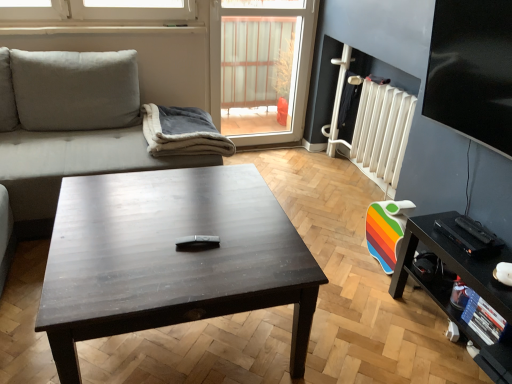
Question: Is the position of gray fleece blanket at center less distant than that of black glossy tv stand at lower right?

Choices:
 (A) no
 (B) yes

Answer: (A)

Question: Is gray fleece blanket at center far away from black glossy tv stand at lower right?

Choices:
 (A) yes
 (B) no

Answer: (A)

Question: Is gray fleece blanket at center aimed at black glossy tv stand at lower right?

Choices:
 (A) yes
 (B) no

Answer: (B)

Question: Can you confirm if gray fleece blanket at center is thinner than black glossy tv stand at lower right?

Choices:
 (A) yes
 (B) no

Answer: (B)

Question: From the image's perspective, is gray fleece blanket at center over black glossy tv stand at lower right?

Choices:
 (A) no
 (B) yes

Answer: (B)

Question: Is transparent glass window screen at upper right, the 2th window screen viewed from the left, in front of or behind white plastic radiator at right in the image?

Choices:
 (A) front
 (B) behind

Answer: (A)

Question: Is transparent glass window screen at upper right, the 2th window screen viewed from the left, to the left or to the right of white plastic radiator at right in the image?

Choices:
 (A) right
 (B) left

Answer: (A)

Question: Which is correct: transparent glass window screen at upper right, which ranks as the second window screen in back-to-front order, is inside white plastic radiator at right, or outside of it?

Choices:
 (A) outside
 (B) inside

Answer: (A)

Question: Considering the positions of transparent glass window screen at upper right, which ranks as the second window screen in back-to-front order, and white plastic radiator at right in the image, is transparent glass window screen at upper right, which ranks as the second window screen in back-to-front order, taller or shorter than white plastic radiator at right?

Choices:
 (A) short
 (B) tall

Answer: (A)

Question: In the image, is transparent plastic window screen at upper center, placed as the first window screen when sorted from back to front, positioned in front of or behind white plastic radiator at right?

Choices:
 (A) front
 (B) behind

Answer: (B)

Question: Is transparent plastic window screen at upper center, which appears as the 1th window screen when viewed from the left, inside the boundaries of white plastic radiator at right, or outside?

Choices:
 (A) inside
 (B) outside

Answer: (B)

Question: Looking at their shapes, would you say transparent plastic window screen at upper center, which appears as the 1th window screen when viewed from the left, is wider or thinner than white plastic radiator at right?

Choices:
 (A) thin
 (B) wide

Answer: (A)

Question: From a real-world perspective, relative to white plastic radiator at right, is transparent plastic window screen at upper center, placed as the 2th window screen when sorted from right to left, vertically above or below?

Choices:
 (A) above
 (B) below

Answer: (A)

Question: From the image's perspective, is transparent glass window screen at upper right, which is the 1th window screen from right to left, above or below suede-like beige couch at left?

Choices:
 (A) above
 (B) below

Answer: (A)

Question: In the image, is transparent glass window screen at upper right, which is the 1th window screen from right to left, positioned in front of or behind suede-like beige couch at left?

Choices:
 (A) front
 (B) behind

Answer: (A)